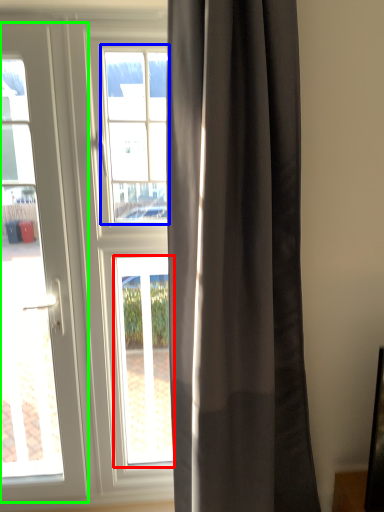
Question: Which object is the closest to the window (highlighted by a red box)? Choose among these: bay window (highlighted by a blue box) or door (highlighted by a green box).

Choices:
 (A) bay window
 (B) door

Answer: (B)